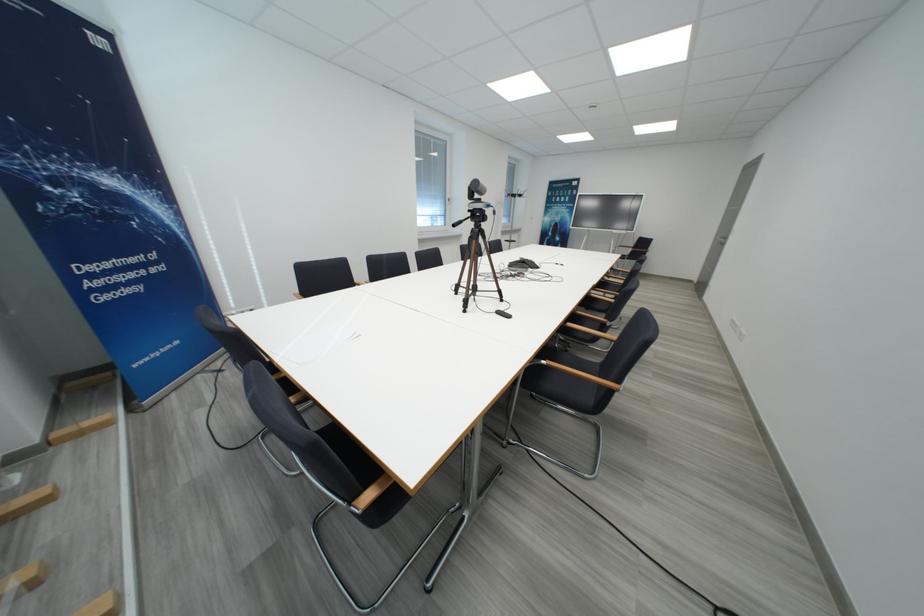
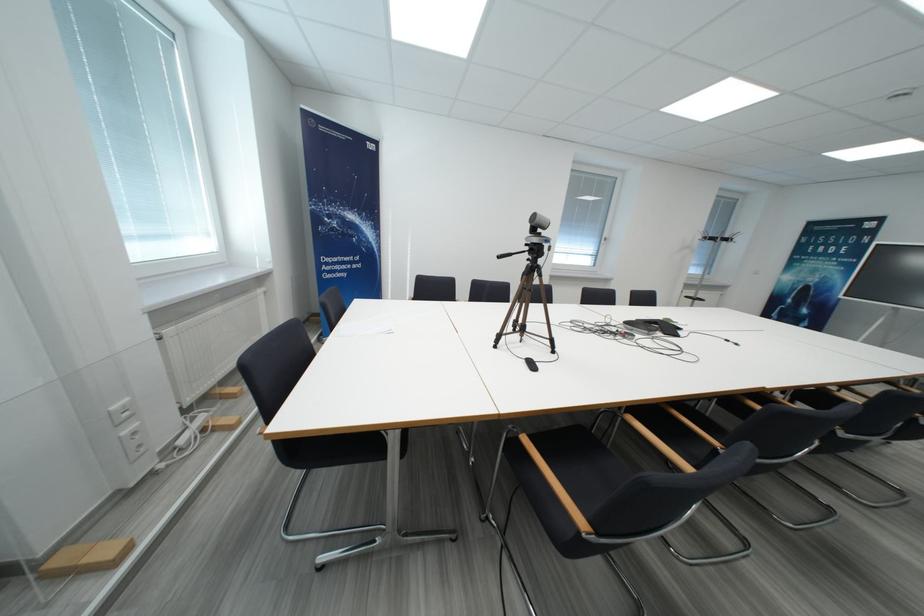
Where in the second image is the point corresponding to point 478,199 from the first image?

(541, 233)